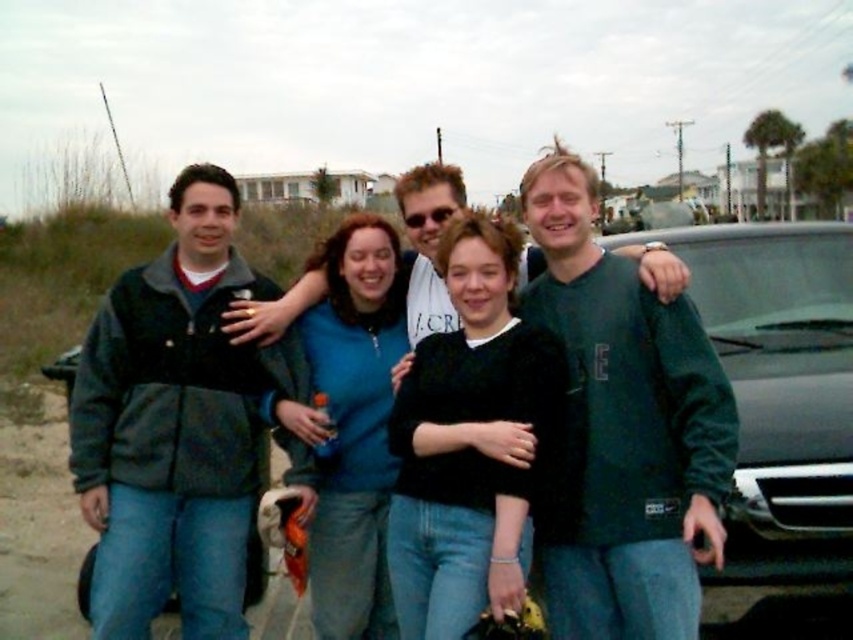
Question: Among these objects, which one is nearest to the camera?

Choices:
 (A) dark gray fleece sweatshirt at center
 (B) dark gray fleece jacket at left
 (C) matte black jacket at center

Answer: (A)

Question: Does dark gray fleece sweatshirt at center appear on the left side of matte black jacket at center?

Choices:
 (A) yes
 (B) no

Answer: (A)

Question: Among these objects, which one is farthest from the camera?

Choices:
 (A) dark gray fleece sweatshirt at center
 (B) matte black jacket at center

Answer: (B)

Question: Can you confirm if dark gray fleece jacket at left is positioned to the right of black fuzzy sweater at center?

Choices:
 (A) no
 (B) yes

Answer: (A)

Question: Which object is farther from the camera taking this photo?

Choices:
 (A) matte black jacket at center
 (B) dark gray fleece jacket at left

Answer: (B)

Question: Does dark gray fleece jacket at left appear on the left side of black fuzzy sweater at center?

Choices:
 (A) yes
 (B) no

Answer: (A)